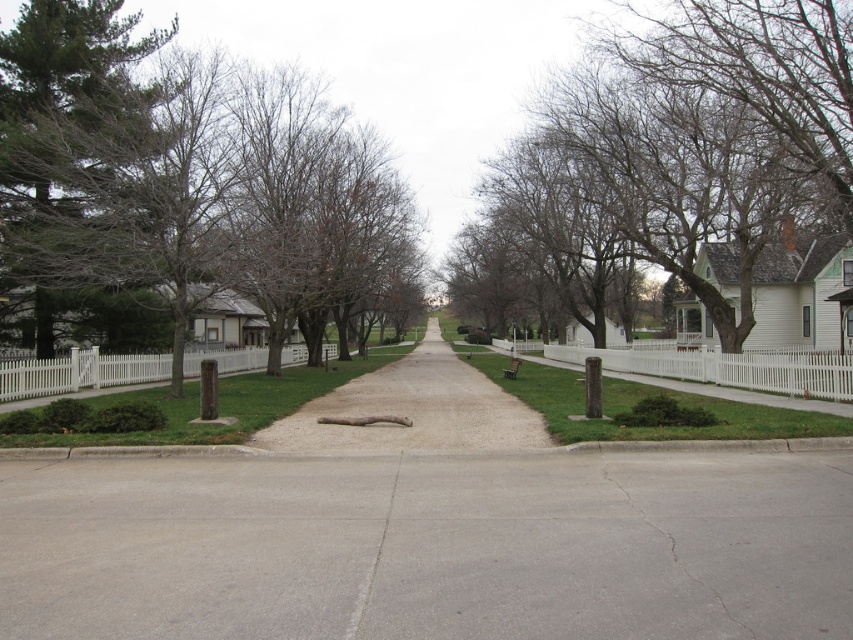
You are a pedestrian walking along the sidewalk next to the white picket fence. You notice a green leafy tree at left and bare branches at upper center. Which object appears bigger in the image?

The green leafy tree at left appears bigger in the image because it has a larger size compared to the bare branches at upper center.